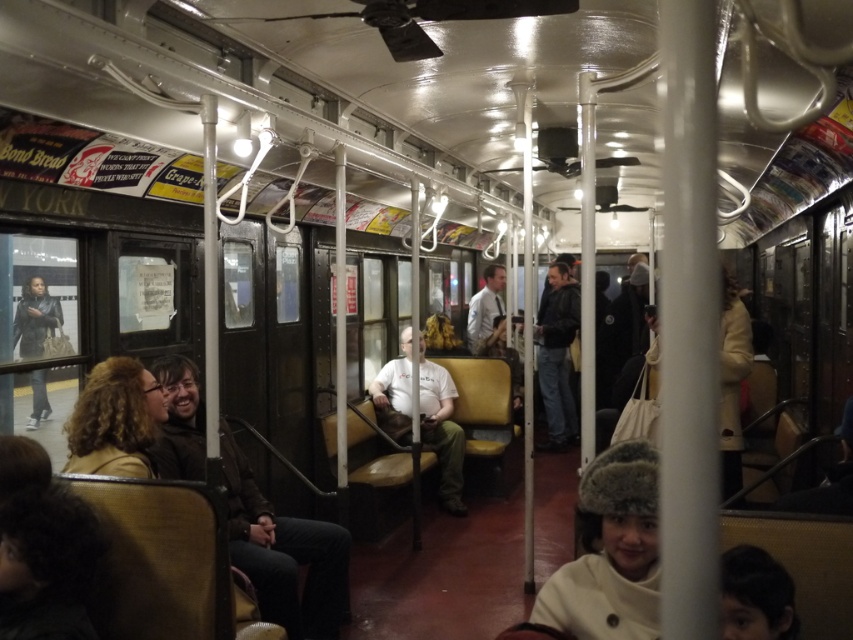
You are a passenger in the subway car and notice two leather jackets hanging on the poles. Which one is positioned to the left side of the other? The jackets are the dark brown leather jacket at center and the light brown leather jacket at center.

The dark brown leather jacket at center is positioned to the left of the light brown leather jacket at center.

You are standing in the subway car and want to place a small backpack on the floor near the dark brown leather jacket at center. Can you estimate where to place it based on the coordinates given?

The dark brown leather jacket at center is located at coordinates point (283, 554). Place the backpack near those coordinates on the floor.

From the picture: You are standing in the subway car and notice a person wearing a light brown leather jacket at center and dark blue jeans at center. Which piece of clothing is nearer to you?

The light brown leather jacket at center is closer to the viewer than the dark blue jeans at center.